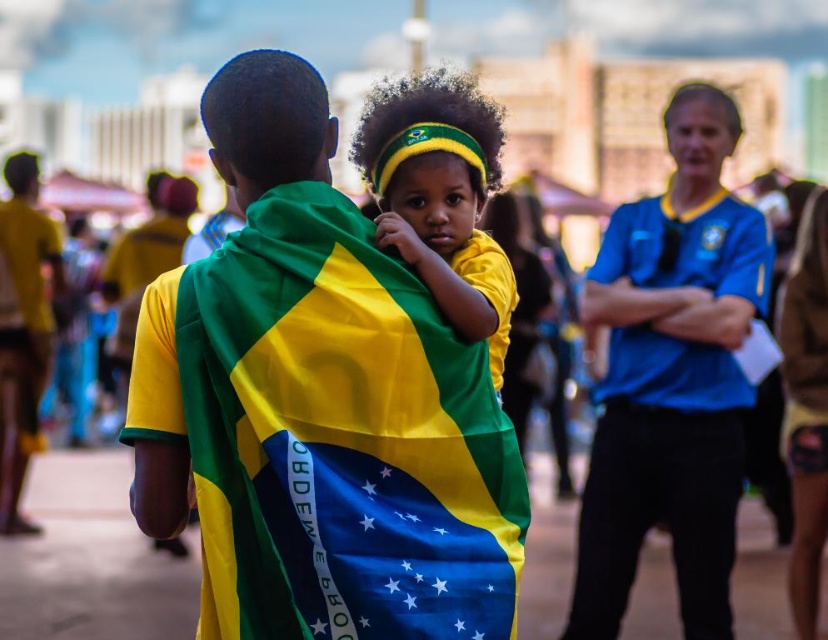
Does matte fabric boy at center appear under matte yellow headband at center?

Yes.

This screenshot has width=828, height=640. What do you see at coordinates (318, 404) in the screenshot?
I see `matte fabric boy at center` at bounding box center [318, 404].

The height and width of the screenshot is (640, 828). Describe the element at coordinates (318, 404) in the screenshot. I see `matte fabric boy at center` at that location.

Where is `matte fabric boy at center`? matte fabric boy at center is located at coordinates (318, 404).